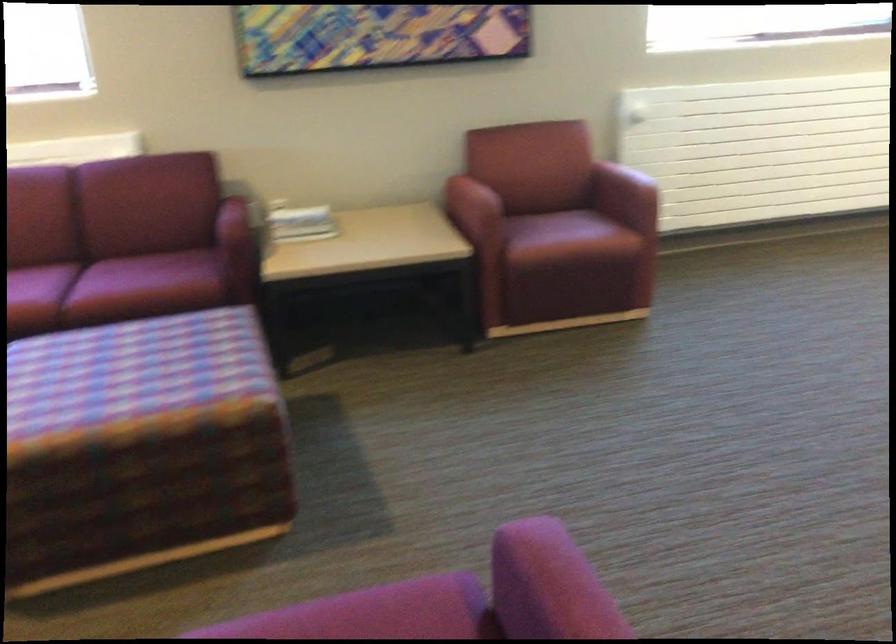
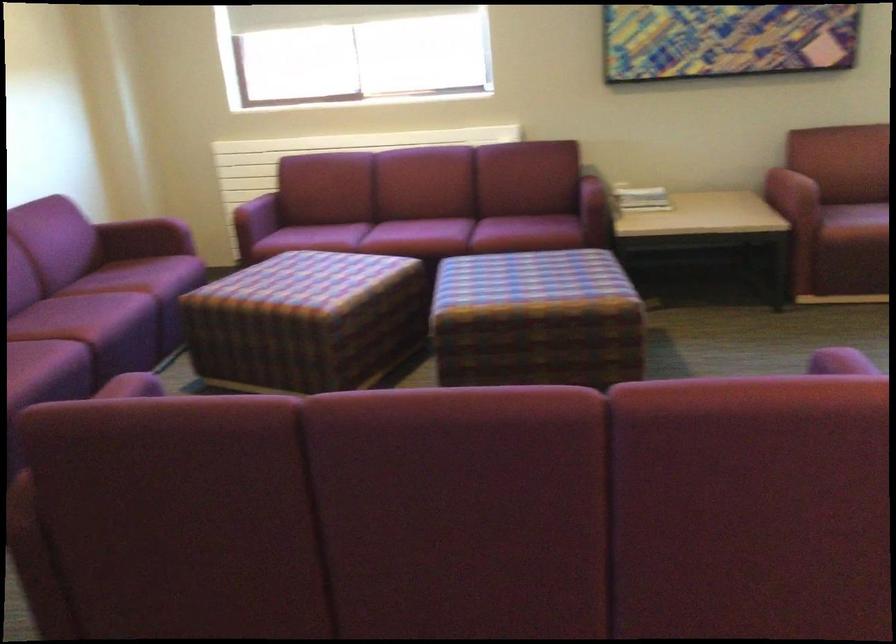
In the second image, find the point that corresponds to pixel 244 202 in the first image.

(596, 178)